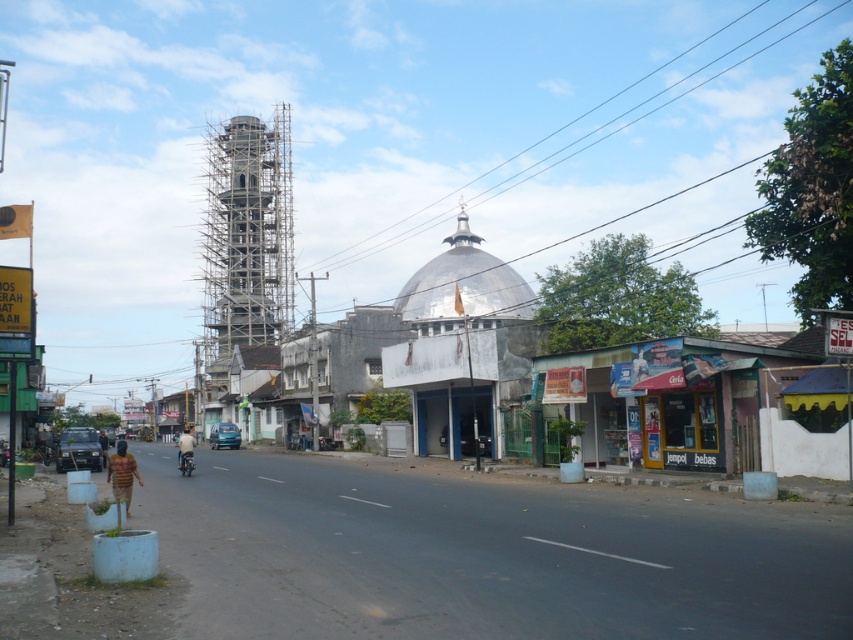
Question: Can you confirm if scaffolding/wooden structure at center-left is positioned above white marble dome at center?

Choices:
 (A) yes
 (B) no

Answer: (A)

Question: Which object appears closest to the camera in this image?

Choices:
 (A) scaffolding/wooden structure at center-left
 (B) shiny metallic motorcycle at center
 (C) white marble dome at center

Answer: (B)

Question: Based on their relative distances, which object is nearer to the scaffolding/wooden structure at center-left?

Choices:
 (A) shiny metallic motorcycle at center
 (B) white marble dome at center

Answer: (B)

Question: Which object appears closest to the camera in this image?

Choices:
 (A) shiny metallic motorcycle at center
 (B) scaffolding/wooden structure at center-left

Answer: (A)

Question: Is white marble dome at center positioned behind shiny metallic motorcycle at center?

Choices:
 (A) no
 (B) yes

Answer: (B)

Question: Is scaffolding/wooden structure at center-left positioned before shiny metallic motorcycle at center?

Choices:
 (A) yes
 (B) no

Answer: (B)